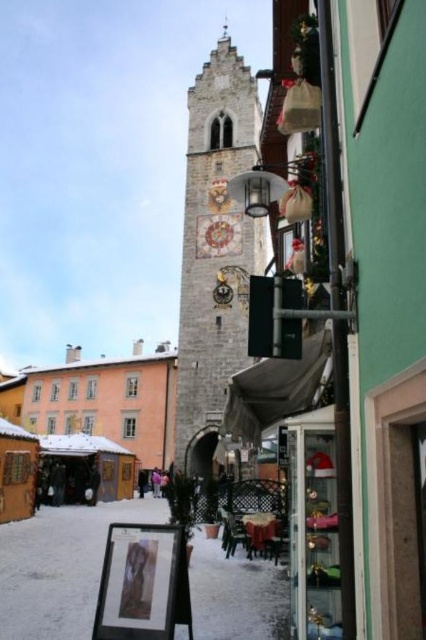
Does point (212, 275) come in front of point (160, 362)?

Yes, it is in front of point (160, 362).

Looking at this image, does stone clock tower at center have a greater width compared to orange matte building at center?

No.

This screenshot has height=640, width=426. I want to click on stone clock tower at center, so click(215, 252).